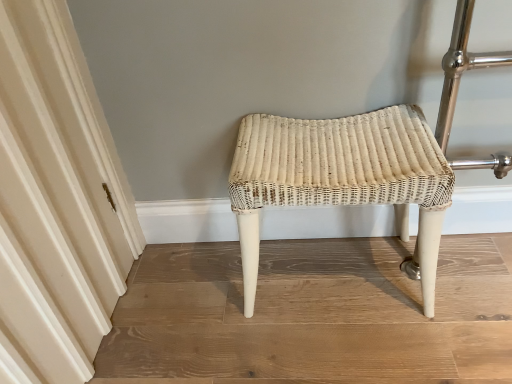
Locate an element on the screen. The height and width of the screenshot is (384, 512). vacant space to the right of white wicker stool at center is located at coordinates (466, 286).